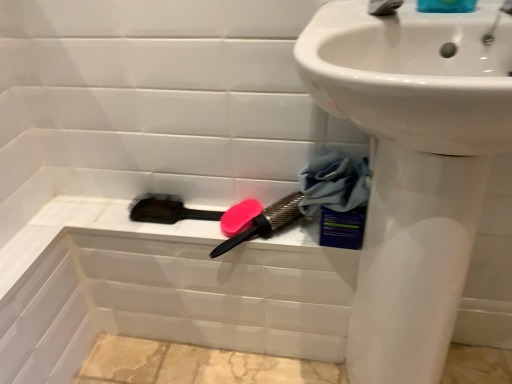
Question: In terms of size, does black bristle brush at lower center, positioned as the 2th brush in right-to-left order, appear bigger or smaller than blue fabric at lower right?

Choices:
 (A) big
 (B) small

Answer: (B)

Question: Looking at their shapes, would you say black bristle brush at lower center, positioned as the 2th brush in right-to-left order, is wider or thinner than blue fabric at lower right?

Choices:
 (A) thin
 (B) wide

Answer: (A)

Question: Which of these objects is positioned farthest from the silver metallic tap at upper right?

Choices:
 (A) blue fabric at lower right
 (B) blue glossy soap at upper right
 (C) pink matte soap at center
 (D) black bristle brush at lower center, positioned as the 2th brush in right-to-left order
 (E) pink rubber brush at upper center, which appears as the 1th brush when viewed from the right

Answer: (D)

Question: Which object is the farthest from the silver metallic tap at upper right?

Choices:
 (A) white glossy sink at upper right
 (B) blue fabric at lower right
 (C) blue glossy soap at upper right
 (D) black bristle brush at lower center, positioned as the 2th brush in right-to-left order
 (E) pink rubber brush at upper center, the 2th brush positioned from the left

Answer: (D)